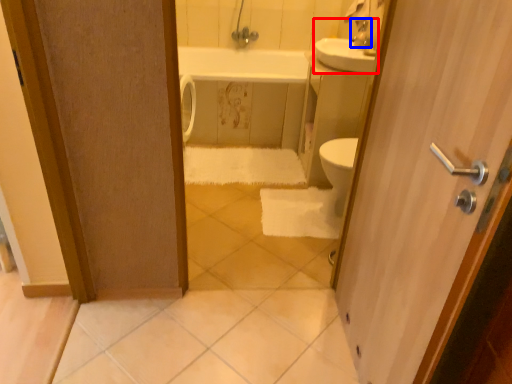
Question: Which object is closer to the camera taking this photo, sink (highlighted by a red box) or faucet (highlighted by a blue box)?

Choices:
 (A) sink
 (B) faucet

Answer: (A)